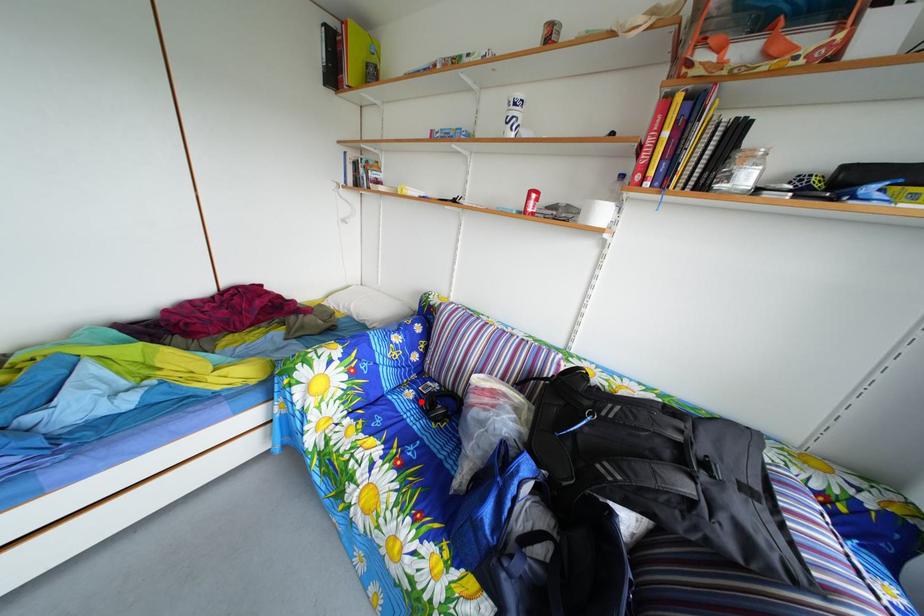
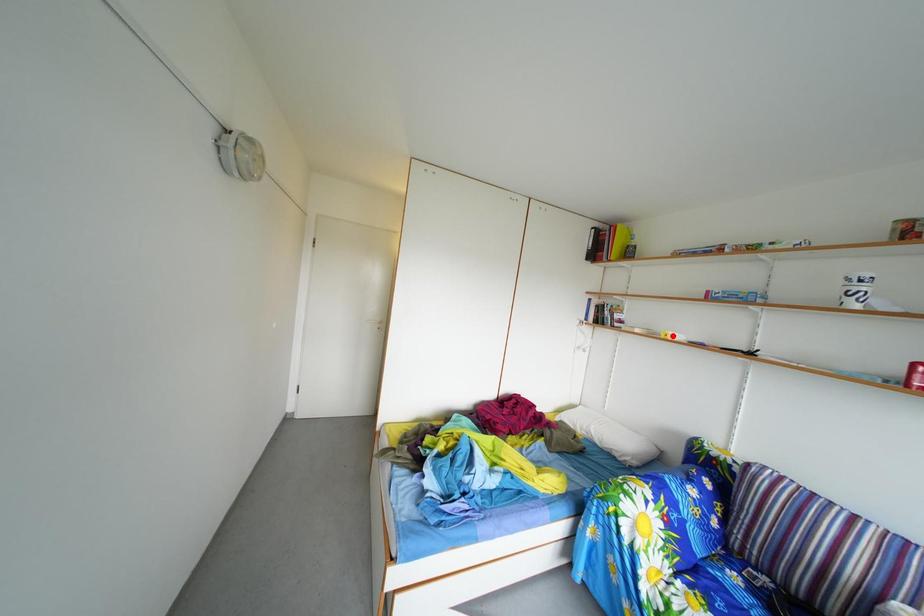
I am providing you with two images of the same scene from different viewpoints. A red point is marked on the first image and another point is marked on the second image. Is the marked point in image1 the same physical position as the marked point in image2?

No